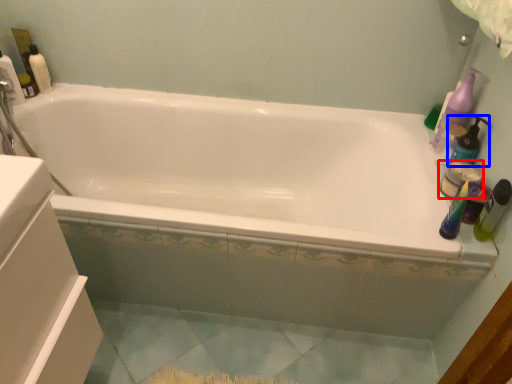
Question: Among these objects, which one is nearest to the camera, toiletry (highlighted by a red box) or cleaning product (highlighted by a blue box)?

Choices:
 (A) toiletry
 (B) cleaning product

Answer: (B)